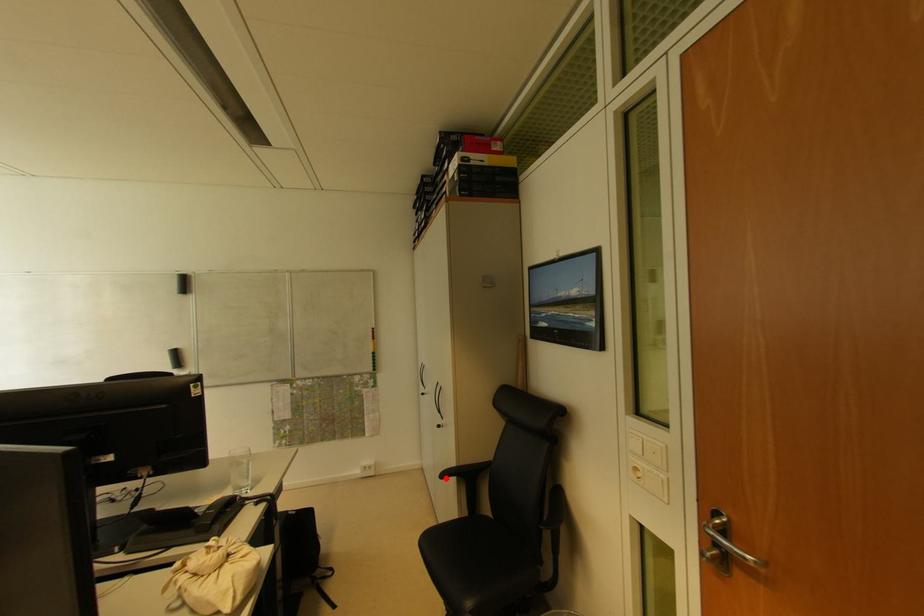
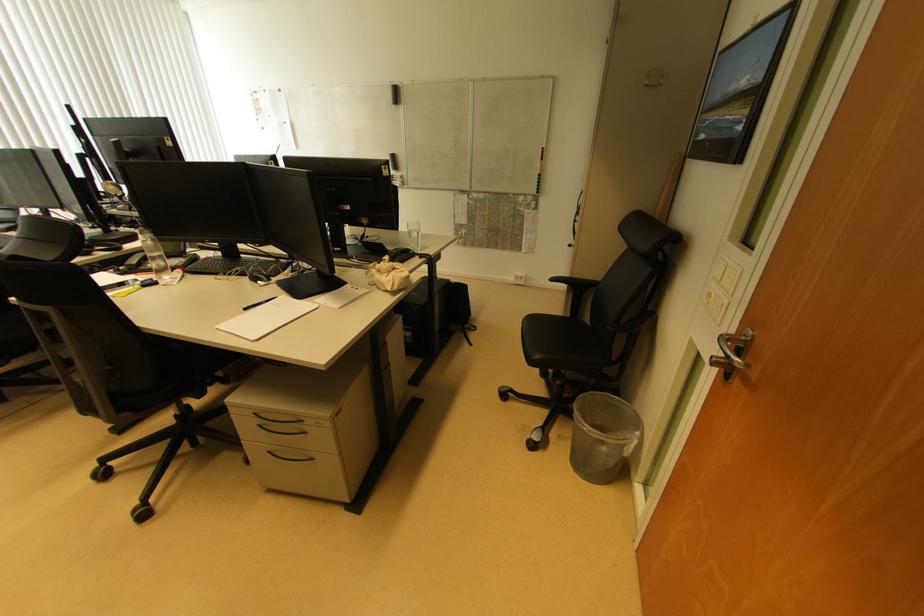
Find the pixel in the second image that matches the highlighted location in the first image.

(555, 282)